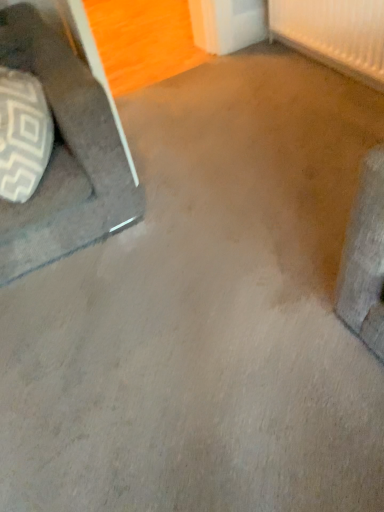
Locate an element on the screen. white textured radiator at upper right is located at coordinates (334, 34).

The image size is (384, 512). What do you see at coordinates (334, 34) in the screenshot?
I see `white textured radiator at upper right` at bounding box center [334, 34].

This screenshot has height=512, width=384. I want to click on white textured radiator at upper right, so click(x=334, y=34).